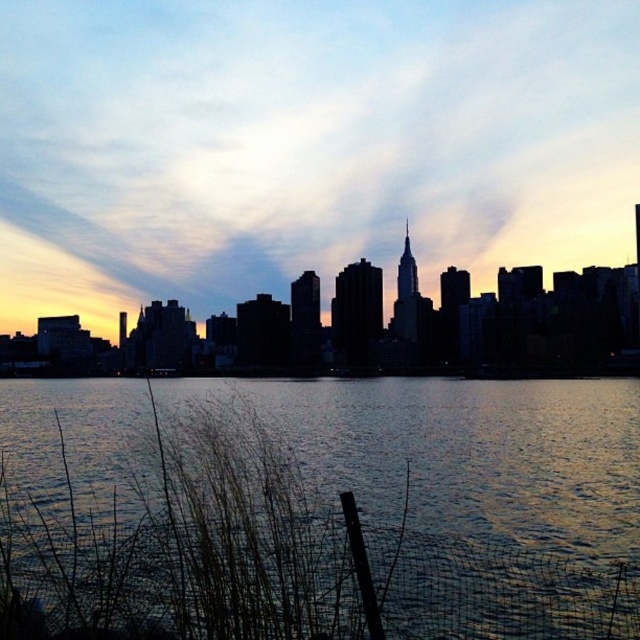
Question: Is dark water at center behind silhouette skyline at center?

Choices:
 (A) yes
 (B) no

Answer: (B)

Question: Is dark water at center closer to camera compared to silhouette skyline at center?

Choices:
 (A) no
 (B) yes

Answer: (B)

Question: Is dark water at center bigger than silhouette skyline at center?

Choices:
 (A) yes
 (B) no

Answer: (B)

Question: Which point is farther from the camera taking this photo?

Choices:
 (A) (81, 548)
 (B) (576, 276)

Answer: (B)